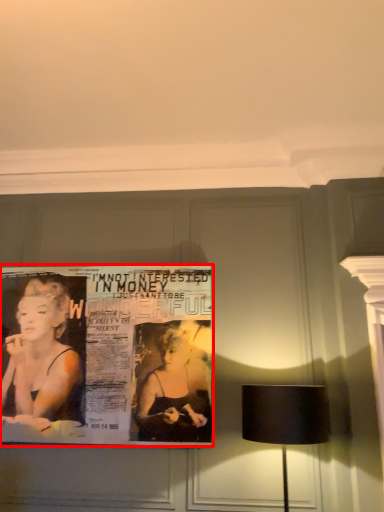
Question: In this image, where is poster (annotated by the red box) located relative to lamp?

Choices:
 (A) right
 (B) left

Answer: (B)